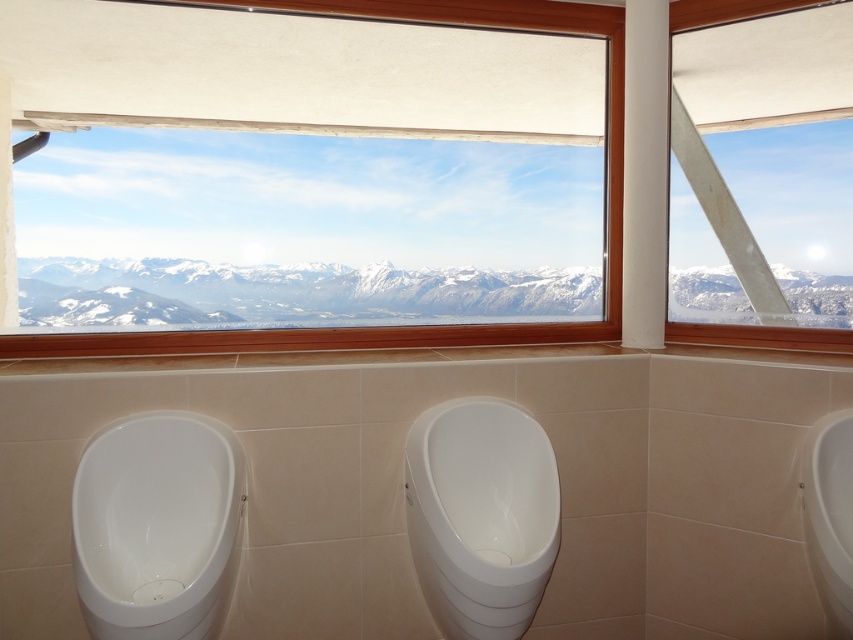
Question: Which of the following is the farthest from the observer?

Choices:
 (A) snowy mountain range at upper center
 (B) white glossy urinal at center
 (C) transparent glass window at upper center

Answer: (A)

Question: Is white glossy urinal at center positioned in front of wooden frame at upper center?

Choices:
 (A) yes
 (B) no

Answer: (A)

Question: Estimate the real-world distances between objects in this image. Which object is closer to the white glossy urinal at center?

Choices:
 (A) transparent glass window at upper center
 (B) white glossy urinal at left
 (C) snowy mountain range at upper center

Answer: (B)

Question: Is white glossy urinal at center below transparent glass window at upper center?

Choices:
 (A) no
 (B) yes

Answer: (B)

Question: Which of these objects is positioned closest to the snowy mountain range at upper center?

Choices:
 (A) white glossy urinal at left
 (B) wooden frame at upper center
 (C) transparent glass window at upper center

Answer: (B)

Question: In this image, where is white glossy urinal at left located relative to white glossy urinal at center?

Choices:
 (A) below
 (B) above

Answer: (B)